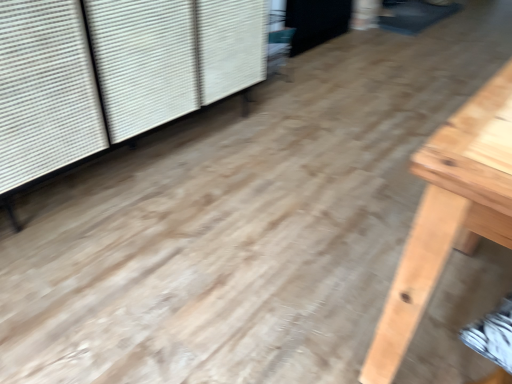
Question: Is black matte screen door at upper center positioned with its back to white textured shutter at upper left?

Choices:
 (A) yes
 (B) no

Answer: (B)

Question: From a real-world perspective, is black matte screen door at upper center over white textured shutter at upper left?

Choices:
 (A) yes
 (B) no

Answer: (B)

Question: Would you say white textured shutter at upper left is part of black matte screen door at upper center's contents?

Choices:
 (A) no
 (B) yes

Answer: (A)

Question: From the image's perspective, does black matte screen door at upper center appear higher than white textured shutter at upper left?

Choices:
 (A) yes
 (B) no

Answer: (A)

Question: Does black matte screen door at upper center have a greater width compared to white textured shutter at upper left?

Choices:
 (A) no
 (B) yes

Answer: (A)

Question: Considering the relative sizes of black matte screen door at upper center and white textured shutter at upper left in the image provided, is black matte screen door at upper center bigger than white textured shutter at upper left?

Choices:
 (A) yes
 (B) no

Answer: (B)

Question: Is the surface of white textured shutter at upper left in direct contact with black matte screen door at upper center?

Choices:
 (A) yes
 (B) no

Answer: (B)

Question: Is white textured shutter at upper left behind black matte screen door at upper center?

Choices:
 (A) yes
 (B) no

Answer: (B)

Question: Is white textured shutter at upper left to the right of black matte screen door at upper center from the viewer's perspective?

Choices:
 (A) no
 (B) yes

Answer: (A)

Question: Does white textured shutter at upper left appear on the left side of black matte screen door at upper center?

Choices:
 (A) no
 (B) yes

Answer: (B)

Question: From the image's perspective, is white textured shutter at upper left above black matte screen door at upper center?

Choices:
 (A) no
 (B) yes

Answer: (A)

Question: From a real-world perspective, is white textured shutter at upper left positioned over black matte screen door at upper center based on gravity?

Choices:
 (A) no
 (B) yes

Answer: (B)

Question: Looking at their shapes, would you say white textured shutter at upper left is wider or thinner than black matte screen door at upper center?

Choices:
 (A) thin
 (B) wide

Answer: (B)